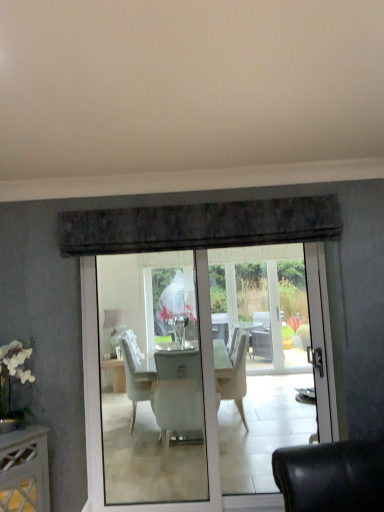
Find the location of a particular element. This screenshot has height=512, width=384. matte white lampshade at center is located at coordinates (114, 325).

Describe the element at coordinates (114, 325) in the screenshot. I see `matte white lampshade at center` at that location.

The height and width of the screenshot is (512, 384). Identify the location of translucent glass vase at center. (178, 319).

The width and height of the screenshot is (384, 512). Describe the element at coordinates (178, 319) in the screenshot. I see `translucent glass vase at center` at that location.

Measure the distance between translucent glass vase at center and camera.

translucent glass vase at center is 18.99 feet away from camera.

You are a GUI agent. You are given a task and a screenshot of the screen. Output one action in this format:
    pyautogui.click(x=<x>, y=<y>)
    Task: Click on the matte white lampshade at center
    
    Given the screenshot: What is the action you would take?
    pyautogui.click(x=114, y=325)

Can you confirm if matte white lampshade at center is positioned to the left of translucent glass vase at center?

Correct, you'll find matte white lampshade at center to the left of translucent glass vase at center.

Which is in front, matte white lampshade at center or translucent glass vase at center?

translucent glass vase at center is closer to the camera.

Consider the image. Which point is more forward, (116, 335) or (190, 318)?

Point (190, 318)

From the image's perspective, is matte white lampshade at center under translucent glass vase at center?

Correct, matte white lampshade at center appears lower than translucent glass vase at center in the image.

From a real-world perspective, is matte white lampshade at center located beneath translucent glass vase at center?

Yes, from a real-world perspective, matte white lampshade at center is under translucent glass vase at center.

Between matte white lampshade at center and translucent glass vase at center, which one has smaller width?

With smaller width is matte white lampshade at center.

Considering the sizes of matte white lampshade at center and translucent glass vase at center in the image, is matte white lampshade at center taller or shorter than translucent glass vase at center?

In the image, matte white lampshade at center appears to be taller than translucent glass vase at center.

Who is bigger, matte white lampshade at center or translucent glass vase at center?

With larger size is translucent glass vase at center.

Would you say matte white lampshade at center is outside translucent glass vase at center?

Absolutely, matte white lampshade at center is external to translucent glass vase at center.

Is matte white lampshade at center in contact with translucent glass vase at center?

matte white lampshade at center and translucent glass vase at center are clearly separated.

Is matte white lampshade at center aimed at translucent glass vase at center?

No, matte white lampshade at center is not facing towards translucent glass vase at center.

How different are the orientations of matte white lampshade at center and translucent glass vase at center in degrees?

9.27e-05 degrees separate the facing orientations of matte white lampshade at center and translucent glass vase at center.

How distant is matte white lampshade at center from translucent glass vase at center?

They are 34.22 inches apart.

Identify the location of flower on the right of matte white lampshade at center. The width and height of the screenshot is (384, 512). (178, 319).

Is translucent glass vase at center at the left side of matte white lampshade at center?

Incorrect, translucent glass vase at center is not on the left side of matte white lampshade at center.

Considering the positions of objects translucent glass vase at center and matte white lampshade at center in the image provided, who is in front, translucent glass vase at center or matte white lampshade at center?

translucent glass vase at center is more forward.

Which is closer, (179, 315) or (112, 324)?

Point (179, 315) is positioned closer to the camera compared to point (112, 324).

From the image's perspective, is translucent glass vase at center over matte white lampshade at center?

Indeed, from the image's perspective, translucent glass vase at center is shown above matte white lampshade at center.

From a real-world perspective, between translucent glass vase at center and matte white lampshade at center, who is vertically lower?

From a 3D spatial view, matte white lampshade at center is below.

Considering the sizes of objects translucent glass vase at center and matte white lampshade at center in the image provided, who is thinner, translucent glass vase at center or matte white lampshade at center?

With smaller width is matte white lampshade at center.

In the scene shown: Is translucent glass vase at center shorter than matte white lampshade at center?

Yes.

Can you confirm if translucent glass vase at center is smaller than matte white lampshade at center?

No, translucent glass vase at center is not smaller than matte white lampshade at center.

Is matte white lampshade at center inside translucent glass vase at center?

No, matte white lampshade at center is not surrounded by translucent glass vase at center.

Is translucent glass vase at center placed right next to matte white lampshade at center?

translucent glass vase at center and matte white lampshade at center are clearly separated.

Looking at this image, is translucent glass vase at center facing towards matte white lampshade at center?

No, translucent glass vase at center does not turn towards matte white lampshade at center.

Can you tell me how much translucent glass vase at center and matte white lampshade at center differ in facing direction?

The angular difference between translucent glass vase at center and matte white lampshade at center is 9.27e-05 degrees.

The width and height of the screenshot is (384, 512). Identify the location of flower located on the right of matte white lampshade at center. (178, 319).

The image size is (384, 512). I want to click on flower that appears above the matte white lampshade at center (from the image's perspective), so click(178, 319).

Identify the location of lamp below the translucent glass vase at center (from a real-world perspective). This screenshot has width=384, height=512. (114, 325).